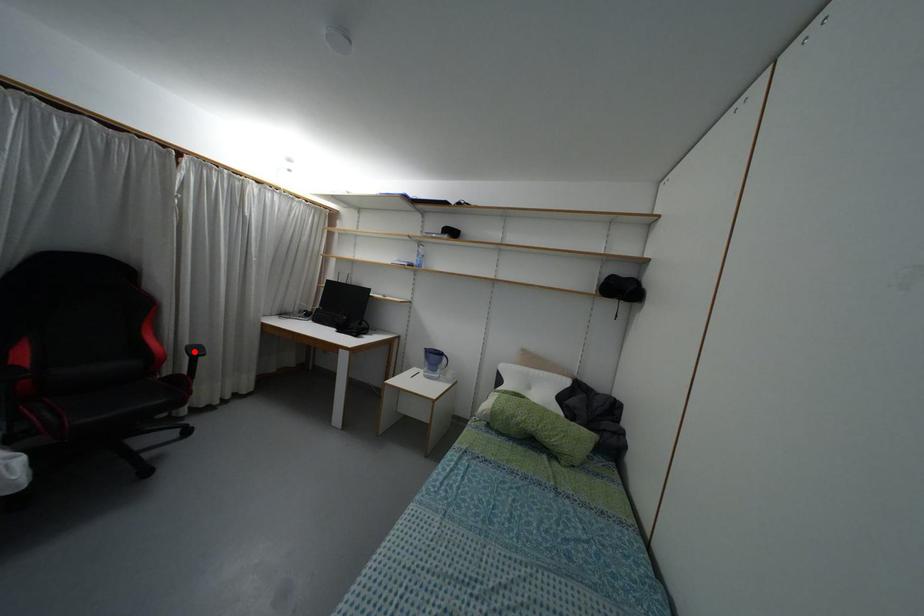
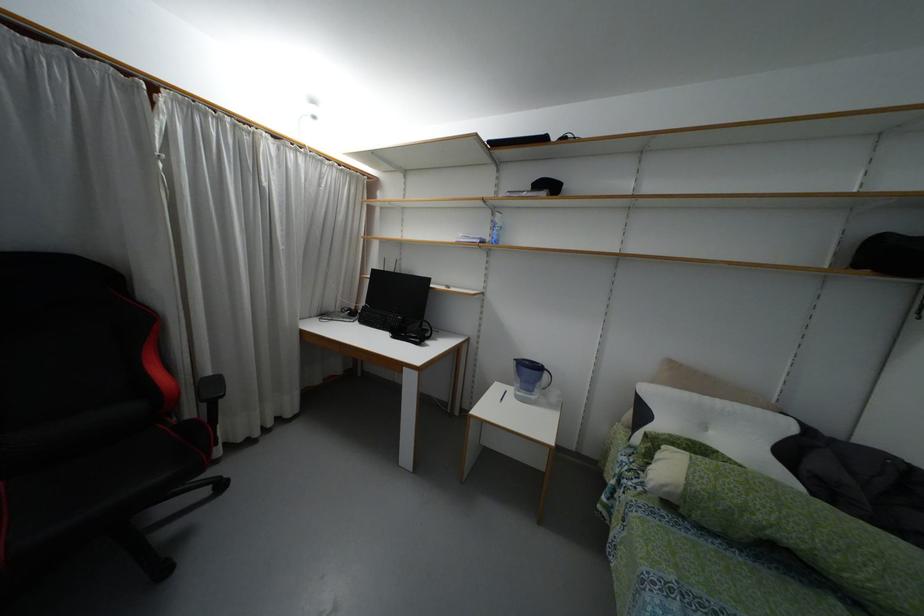
Where in the second image is the point corresponding to the highlighted location from the first image?

(213, 387)